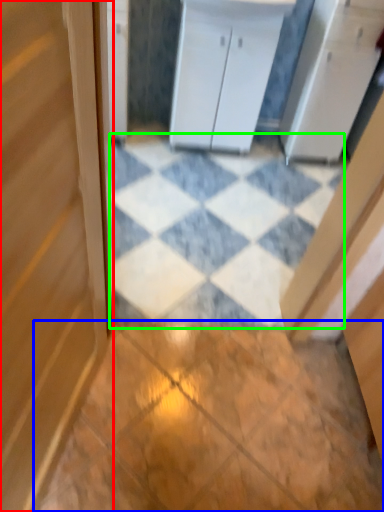
Question: Which object is the closest to the door (highlighted by a red box)? Choose among these: tile (highlighted by a blue box) or tile (highlighted by a green box).

Choices:
 (A) tile
 (B) tile

Answer: (A)